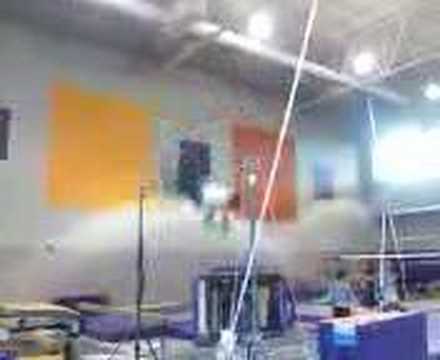
This screenshot has height=360, width=440. I want to click on clothes rack, so (199, 294), (213, 294), (223, 292), (230, 293), (246, 294), (261, 298), (274, 299), (281, 298).